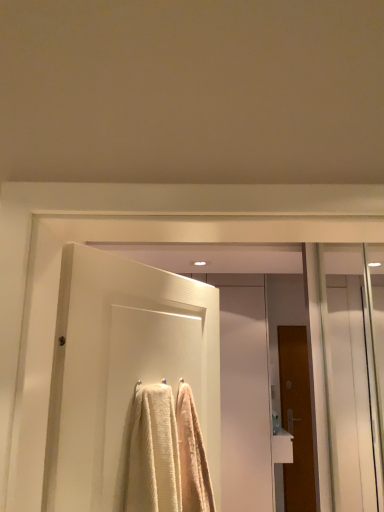
Question: Is point (72, 288) closer or farther from the camera than point (284, 381)?

Choices:
 (A) closer
 (B) farther

Answer: (A)

Question: Is white textured door at center, which is the 1th door in left-to-right order, taller or shorter than brown wooden door at right, the second door positioned from the top?

Choices:
 (A) tall
 (B) short

Answer: (B)

Question: Which object is the farthest from the brown wooden door at right, which appears as the 2th door when viewed from the left?

Choices:
 (A) transparent glass screen door at right, marked as the 2th screen door in a left-to-right arrangement
 (B) white textured door at center, which is the 1th door in left-to-right order
 (C) white glossy door at center, marked as the second screen door in a front-to-back arrangement
 (D) white glossy sink at lower right

Answer: (B)

Question: Which is nearer to the transparent glass screen door at right, placed as the 1th screen door when sorted from right to left?

Choices:
 (A) brown wooden door at right, the 1th door when ordered from back to front
 (B) white textured door at center, the 2th door when ordered from back to front
 (C) white glossy sink at lower right
 (D) white glossy door at center, marked as the second screen door in a front-to-back arrangement

Answer: (A)